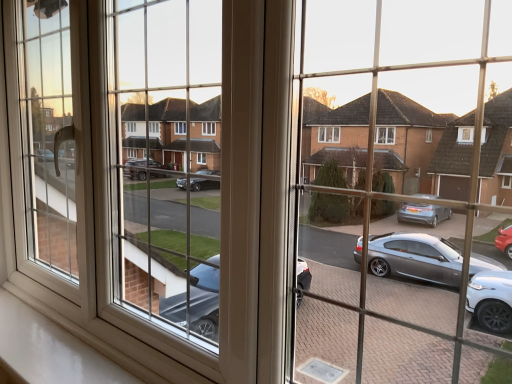
Describe the element at coordinates (105, 337) in the screenshot. I see `white glossy window sill at lower left` at that location.

Measure the distance between point (62, 319) and camera.

Point (62, 319) and camera are 4.06 feet apart from each other.

Where is `white glossy window sill at lower left`? The image size is (512, 384). white glossy window sill at lower left is located at coordinates (105, 337).

Where is `white glossy window sill at lower left`? Image resolution: width=512 pixels, height=384 pixels. white glossy window sill at lower left is located at coordinates (105, 337).